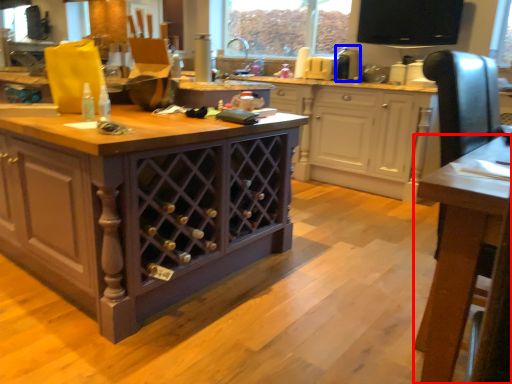
Question: Which object is closer to the camera taking this photo, table (highlighted by a red box) or appliance (highlighted by a blue box)?

Choices:
 (A) table
 (B) appliance

Answer: (A)